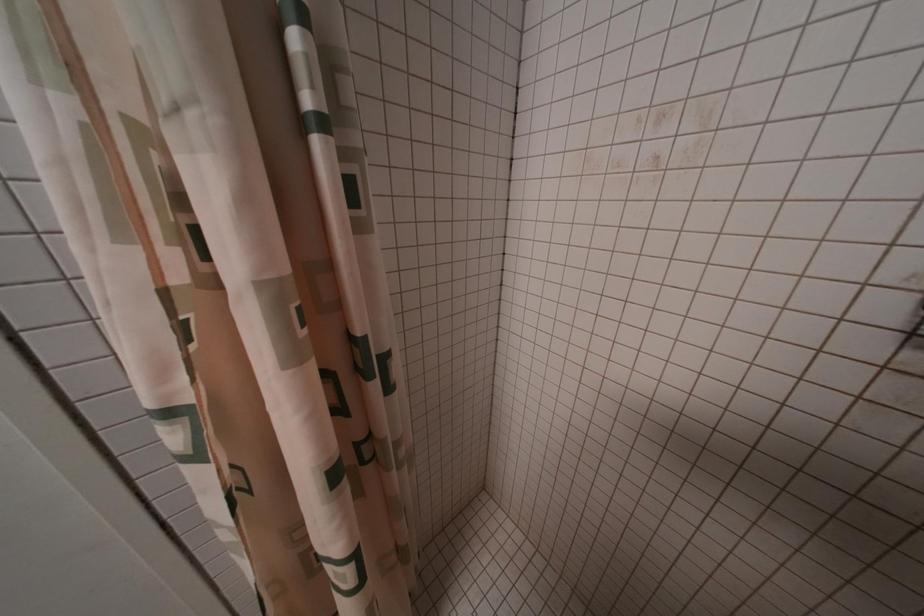
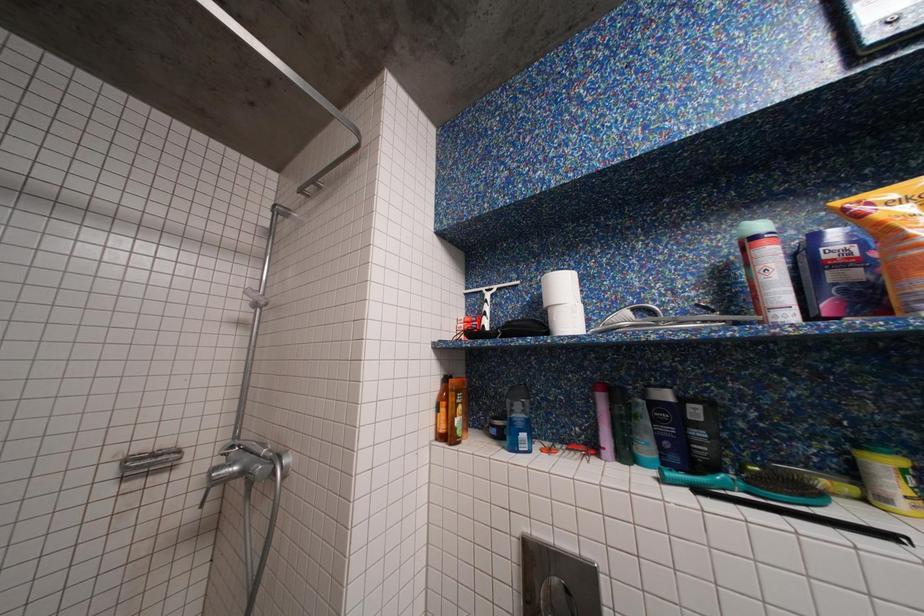
Question: The first image is from the beginning of the video and the second image is from the end. How did the camera likely rotate when shooting the video?

Choices:
 (A) Left
 (B) Right
 (C) Up
 (D) Down

Answer: (B)